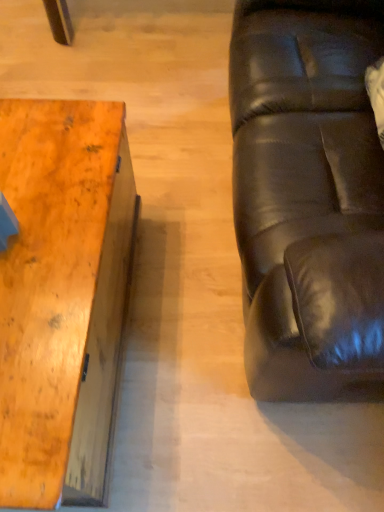
Where is `free spot above wooden table at left (from a real-world perspective)`? The image size is (384, 512). free spot above wooden table at left (from a real-world perspective) is located at coordinates (34, 225).